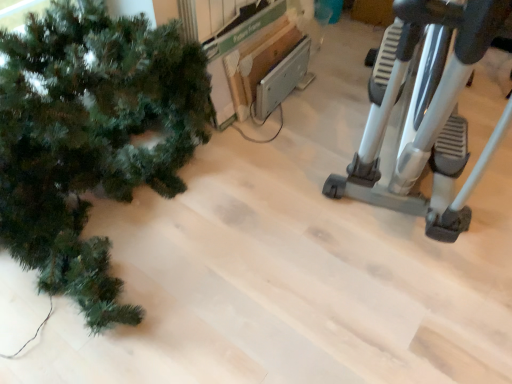
The width and height of the screenshot is (512, 384). What are the coordinates of `free point below green matte christmas tree at left (from a real-world perspective)` in the screenshot? It's located at (158, 216).